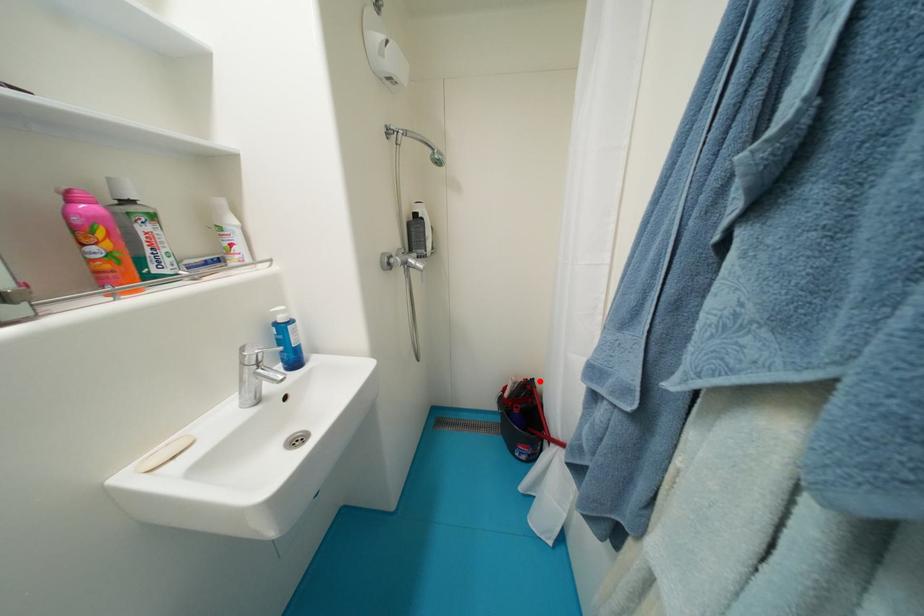
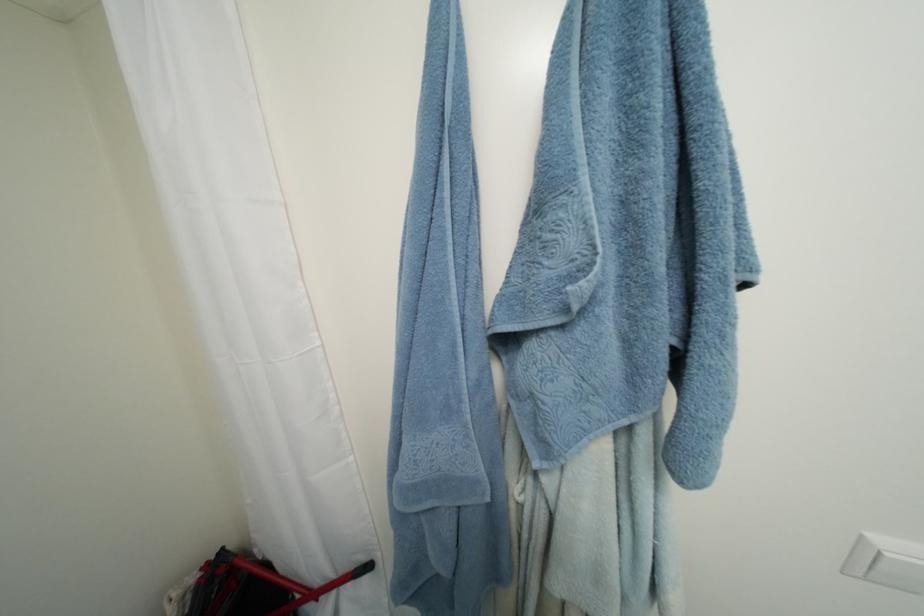
Locate, in the second image, the point that corresponds to the highlighted location in the first image.

(229, 552)